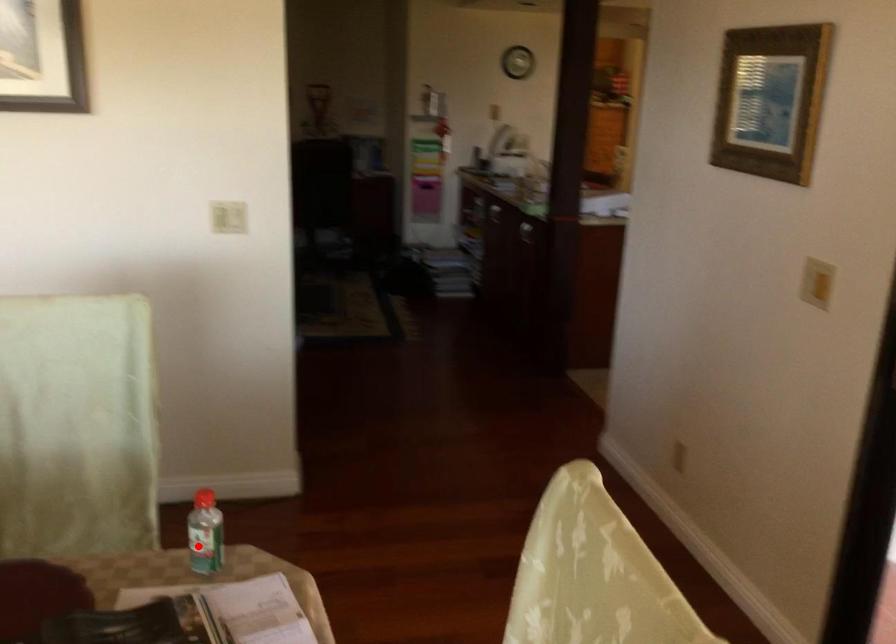
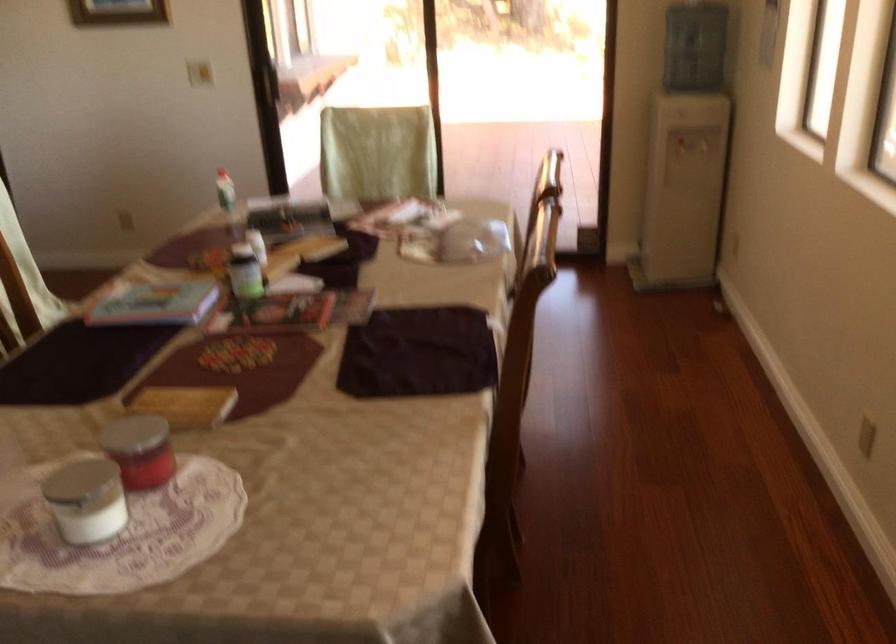
Question: A red point is marked in image1. In image2, is the corresponding 3D point closer to the camera or farther? Reply with the corresponding letter.

Choices:
 (A) The corresponding 3D point is closer.
 (B) The corresponding 3D point is farther.

Answer: (B)